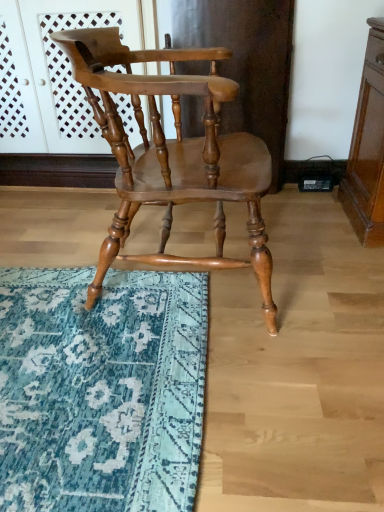
You are a GUI agent. You are given a task and a screenshot of the screen. Output one action in this format:
    pyautogui.click(x=<x>, y=<y>)
    Task: Click on the blank space above teal rug at lower left (from a real-world perspective)
    
    Given the screenshot: What is the action you would take?
    pyautogui.click(x=77, y=296)